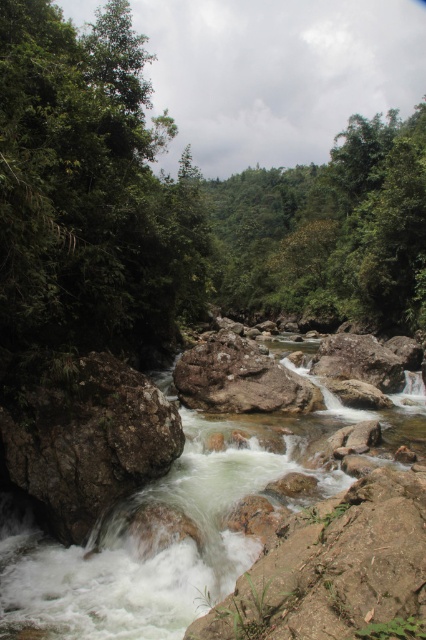
Which is above, rocky white water at center or brown rough rock at center?

Positioned higher is brown rough rock at center.

Where is `rocky white water at center`? rocky white water at center is located at coordinates (175, 541).

Which is behind, point (195, 452) or point (244, 388)?

The point (244, 388) is more distant.

The image size is (426, 640). In order to click on rocky white water at center in this screenshot , I will do `click(175, 541)`.

Does rocky white water at center have a lesser width compared to rough textured rock at center?

No.

Is rocky white water at center in front of rough textured rock at center?

Yes.

Which is in front, point (34, 572) or point (106, 372)?

Point (34, 572) is more forward.

I want to click on rocky white water at center, so click(175, 541).

Is point (158, 440) less distant than point (219, 403)?

That is True.

Does rough textured rock at center appear over brown rough rock at center?

No, rough textured rock at center is not above brown rough rock at center.

The height and width of the screenshot is (640, 426). Describe the element at coordinates (86, 440) in the screenshot. I see `rough textured rock at center` at that location.

Identify the location of rough textured rock at center. (86, 440).